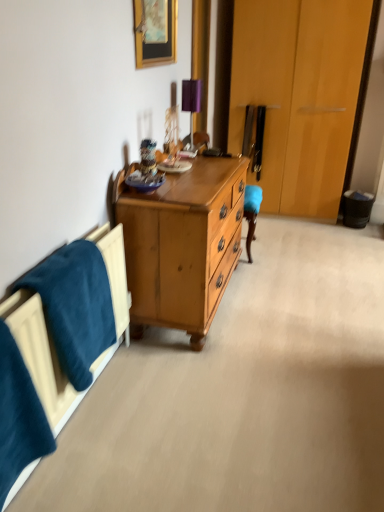
You are a GUI agent. You are given a task and a screenshot of the screen. Output one action in this format:
    pyautogui.click(x=<x>, y=<y>)
    Task: Click on the velvety blue blanket at lower left, which is the first blanket in front-to-back order
    This screenshot has width=384, height=512.
    Given the screenshot: What is the action you would take?
    pyautogui.click(x=19, y=416)

You are a GUI agent. You are given a task and a screenshot of the screen. Output one action in this format:
    pyautogui.click(x=<x>, y=<y>)
    Task: Click on the picture frame in front of the purple fabric table lamp at upper center
    This screenshot has height=512, width=384.
    Given the screenshot: What is the action you would take?
    pyautogui.click(x=155, y=32)

Is wooden picture frame at upper center not near purple fabric table lamp at upper center?

No, wooden picture frame at upper center is in close proximity to purple fabric table lamp at upper center.

Who is smaller, wooden picture frame at upper center or purple fabric table lamp at upper center?

purple fabric table lamp at upper center is smaller.

From the picture: From the image's perspective, which object appears higher, velvety blue blanket at lower left, which is the second blanket in front-to-back order, or velvety blue blanket at lower left, which is the first blanket in front-to-back order?

velvety blue blanket at lower left, which is the second blanket in front-to-back order, appears higher in the image.

In terms of size, does velvety blue blanket at lower left, which is the second blanket in front-to-back order, appear bigger or smaller than velvety blue blanket at lower left, which is the 2th blanket in back-to-front order?

In the image, velvety blue blanket at lower left, which is the second blanket in front-to-back order, appears to be larger than velvety blue blanket at lower left, which is the 2th blanket in back-to-front order.

Which is in front, point (87, 370) or point (37, 397)?

The point (37, 397) is closer.

Between velvety blue blanket at lower left, which is the second blanket in front-to-back order, and velvety blue blanket at lower left, which is the first blanket in front-to-back order, which one has smaller width?

Thinner between the two is velvety blue blanket at lower left, which is the first blanket in front-to-back order.

Looking at this image, considering the positions of objects purple fabric table lamp at upper center and velvety blue blanket at lower left, which is the second blanket in front-to-back order, in the image provided, who is behind, purple fabric table lamp at upper center or velvety blue blanket at lower left, which is the second blanket in front-to-back order,?

purple fabric table lamp at upper center is behind.

In the image, is purple fabric table lamp at upper center on the left side or the right side of velvety blue blanket at lower left, arranged as the first blanket when viewed from the back?

Based on their positions, purple fabric table lamp at upper center is located to the right of velvety blue blanket at lower left, arranged as the first blanket when viewed from the back.

Between purple fabric table lamp at upper center and velvety blue blanket at lower left, which is the second blanket in front-to-back order, which one has less height?

Standing shorter between the two is purple fabric table lamp at upper center.

Considering the positions of point (182, 102) and point (161, 31), is point (182, 102) closer or farther from the camera than point (161, 31)?

Clearly, point (182, 102) is more distant from the camera than point (161, 31).

Is purple fabric table lamp at upper center taller than wooden picture frame at upper center?

Yes, purple fabric table lamp at upper center is taller than wooden picture frame at upper center.

Is purple fabric table lamp at upper center looking in the opposite direction of wooden picture frame at upper center?

That's not correct — purple fabric table lamp at upper center is not looking away from wooden picture frame at upper center.

Considering the relative sizes of purple fabric table lamp at upper center and wooden picture frame at upper center in the image provided, is purple fabric table lamp at upper center wider than wooden picture frame at upper center?

Yes.

Find the location of a particular element. The width and height of the screenshot is (384, 512). blanket below the velvety blue blanket at lower left, arranged as the first blanket when viewed from the back (from a real-world perspective) is located at coordinates (19, 416).

Would you say velvety blue blanket at lower left, which is the first blanket in front-to-back order, is inside or outside velvety blue blanket at lower left, which is the second blanket in front-to-back order?

velvety blue blanket at lower left, which is the first blanket in front-to-back order, is not inside velvety blue blanket at lower left, which is the second blanket in front-to-back order, it's outside.

From a real-world perspective, is velvety blue blanket at lower left, which is the 2th blanket in back-to-front order, physically below velvety blue blanket at lower left, arranged as the first blanket when viewed from the back?

Yes, from a real-world perspective, velvety blue blanket at lower left, which is the 2th blanket in back-to-front order, is below velvety blue blanket at lower left, arranged as the first blanket when viewed from the back.

Is velvety blue blanket at lower left, which is the 2th blanket in back-to-front order, bigger than velvety blue blanket at lower left, arranged as the first blanket when viewed from the back?

Incorrect, velvety blue blanket at lower left, which is the 2th blanket in back-to-front order, is not larger than velvety blue blanket at lower left, arranged as the first blanket when viewed from the back.

How much distance is there between wooden picture frame at upper center and velvety blue blanket at lower left, which is the 2th blanket in back-to-front order?

wooden picture frame at upper center is 1.68 meters from velvety blue blanket at lower left, which is the 2th blanket in back-to-front order.

Is velvety blue blanket at lower left, which is the first blanket in front-to-back order, a part of wooden picture frame at upper center?

Definitely not — velvety blue blanket at lower left, which is the first blanket in front-to-back order, is not inside wooden picture frame at upper center.

From a real-world perspective, is wooden picture frame at upper center positioned over velvety blue blanket at lower left, which is the 2th blanket in back-to-front order, based on gravity?

Correct, in the physical world, wooden picture frame at upper center is higher than velvety blue blanket at lower left, which is the 2th blanket in back-to-front order.

Which object is further away from the camera taking this photo, wooden picture frame at upper center or velvety blue blanket at lower left, which is the first blanket in front-to-back order?

wooden picture frame at upper center is more distant.

Does purple fabric table lamp at upper center touch velvety blue blanket at lower left, which is the 2th blanket in back-to-front order?

No, purple fabric table lamp at upper center is not with velvety blue blanket at lower left, which is the 2th blanket in back-to-front order.

Considering the relative sizes of purple fabric table lamp at upper center and velvety blue blanket at lower left, which is the 2th blanket in back-to-front order, in the image provided, is purple fabric table lamp at upper center bigger than velvety blue blanket at lower left, which is the 2th blanket in back-to-front order,?

Incorrect, purple fabric table lamp at upper center is not larger than velvety blue blanket at lower left, which is the 2th blanket in back-to-front order.

From a real-world perspective, between purple fabric table lamp at upper center and velvety blue blanket at lower left, which is the 2th blanket in back-to-front order, who is vertically lower?

velvety blue blanket at lower left, which is the 2th blanket in back-to-front order, from a real-world perspective.

Is purple fabric table lamp at upper center oriented towards velvety blue blanket at lower left, which is the 2th blanket in back-to-front order?

No, purple fabric table lamp at upper center is not oriented towards velvety blue blanket at lower left, which is the 2th blanket in back-to-front order.

Find the location of a particular element. table lamp lying behind the wooden picture frame at upper center is located at coordinates (191, 95).

This screenshot has width=384, height=512. Find the location of `blanket above the velvety blue blanket at lower left, which is the 2th blanket in back-to-front order (from the image's perspective)`. blanket above the velvety blue blanket at lower left, which is the 2th blanket in back-to-front order (from the image's perspective) is located at coordinates (75, 306).

Considering their positions, is wooden picture frame at upper center positioned further to purple fabric table lamp at upper center than velvety blue blanket at lower left, which is the 2th blanket in back-to-front order?

velvety blue blanket at lower left, which is the 2th blanket in back-to-front order.

From the image, which object appears to be farther from purple fabric table lamp at upper center, wooden picture frame at upper center or velvety blue blanket at lower left, which is the second blanket in front-to-back order?

Based on the image, velvety blue blanket at lower left, which is the second blanket in front-to-back order, appears to be further to purple fabric table lamp at upper center.

From the image, which object appears to be nearer to velvety blue blanket at lower left, which is the first blanket in front-to-back order, purple fabric table lamp at upper center or velvety blue blanket at lower left, which is the second blanket in front-to-back order?

Among the two, velvety blue blanket at lower left, which is the second blanket in front-to-back order, is located nearer to velvety blue blanket at lower left, which is the first blanket in front-to-back order.

Based on their spatial positions, is wooden picture frame at upper center or purple fabric table lamp at upper center closer to velvety blue blanket at lower left, which is the first blanket in front-to-back order?

Based on the image, wooden picture frame at upper center appears to be nearer to velvety blue blanket at lower left, which is the first blanket in front-to-back order.

From the image, which object appears to be farther from wooden picture frame at upper center, velvety blue blanket at lower left, which is the second blanket in front-to-back order, or purple fabric table lamp at upper center?

velvety blue blanket at lower left, which is the second blanket in front-to-back order, is positioned further to the anchor wooden picture frame at upper center.

Which object lies nearer to the anchor point velvety blue blanket at lower left, which is the first blanket in front-to-back order, velvety blue blanket at lower left, arranged as the first blanket when viewed from the back, or purple fabric table lamp at upper center?

velvety blue blanket at lower left, arranged as the first blanket when viewed from the back, lies closer to velvety blue blanket at lower left, which is the first blanket in front-to-back order, than the other object.

Consider the image. When comparing their distances from wooden picture frame at upper center, does purple fabric table lamp at upper center or velvety blue blanket at lower left, which is the 2th blanket in back-to-front order, seem further?

The object further to wooden picture frame at upper center is velvety blue blanket at lower left, which is the 2th blanket in back-to-front order.

Looking at the image, which one is located closer to purple fabric table lamp at upper center, velvety blue blanket at lower left, which is the first blanket in front-to-back order, or wooden picture frame at upper center?

wooden picture frame at upper center is closer to purple fabric table lamp at upper center.

In order to click on blanket that lies between wooden picture frame at upper center and velvety blue blanket at lower left, which is the first blanket in front-to-back order, from top to bottom in this screenshot , I will do `click(75, 306)`.

The image size is (384, 512). Find the location of `table lamp between wooden picture frame at upper center and velvety blue blanket at lower left, which is the second blanket in front-to-back order, vertically`. table lamp between wooden picture frame at upper center and velvety blue blanket at lower left, which is the second blanket in front-to-back order, vertically is located at coordinates (191, 95).

Locate an element on the screen. Image resolution: width=384 pixels, height=512 pixels. blanket positioned between velvety blue blanket at lower left, which is the 2th blanket in back-to-front order, and purple fabric table lamp at upper center from near to far is located at coordinates (75, 306).

Where is `table lamp between wooden picture frame at upper center and velvety blue blanket at lower left, which is the first blanket in front-to-back order, in the vertical direction`? table lamp between wooden picture frame at upper center and velvety blue blanket at lower left, which is the first blanket in front-to-back order, in the vertical direction is located at coordinates (191, 95).